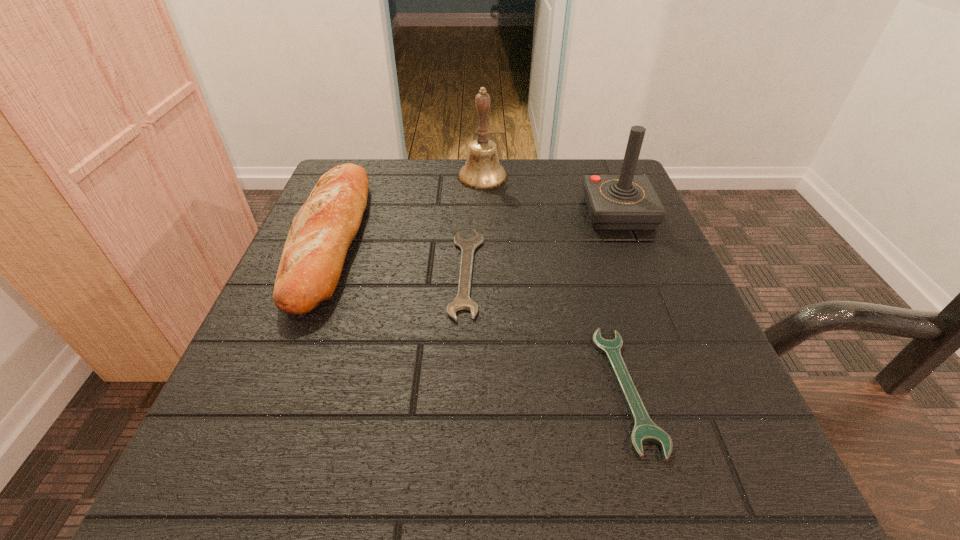
Locate an element on the screen. The height and width of the screenshot is (540, 960). object present at the far right corner is located at coordinates (626, 202).

At what (x,y) coordinates should I click in order to perform the action: click on object situated at the near right corner. Please return your answer as a coordinate pair (x, y). The image size is (960, 540). Looking at the image, I should click on [x=645, y=430].

You are a GUI agent. You are given a task and a screenshot of the screen. Output one action in this format:
    pyautogui.click(x=<x>, y=<y>)
    Task: Click on the vacant space at the far edge of the desktop
    This screenshot has width=960, height=540.
    Given the screenshot: What is the action you would take?
    pyautogui.click(x=511, y=168)

Find the location of `free point at the near edge`. free point at the near edge is located at coordinates (447, 489).

Locate an element on the screen. vacant area at the left edge is located at coordinates click(x=273, y=357).

In the image, there is a desktop. Where is `vacant space at the right edge`? Image resolution: width=960 pixels, height=540 pixels. vacant space at the right edge is located at coordinates (715, 353).

In the image, there is a desktop. In order to click on vacant space at the far left corner in this screenshot , I will do `click(378, 185)`.

In order to click on empty space between the joystick and the nearer wrench in this screenshot , I will do `click(623, 301)`.

This screenshot has width=960, height=540. Find the location of `vacant region between the nearest object and the farther wrench`. vacant region between the nearest object and the farther wrench is located at coordinates (547, 332).

What are the coordinates of `vacant space that's between the joystick and the baguet` in the screenshot? It's located at (473, 225).